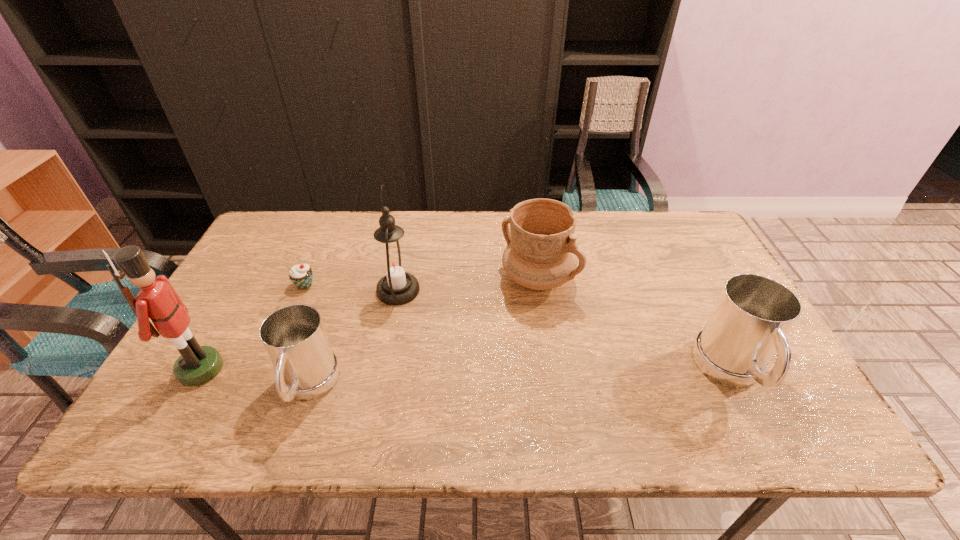
Identify the location of vacant region between the fifth object from left to right and the shortest object. (421, 282).

Where is `object that is the fifth closest to the shortest object`? object that is the fifth closest to the shortest object is located at coordinates (753, 314).

Locate which object ranks in proximity to the fourth object from right to left. Please provide its 2D coordinates. Your answer should be formatted as a tuple, i.e. [(x, y)], where the tuple contains the x and y coordinates of a point satisfying the conditions above.

[(157, 299)]

Where is `free space that satisfies the following two spatial constraints: 1. on the front side of the oil lamp; 2. on the right side of the cupcake`? This screenshot has height=540, width=960. free space that satisfies the following two spatial constraints: 1. on the front side of the oil lamp; 2. on the right side of the cupcake is located at coordinates (302, 291).